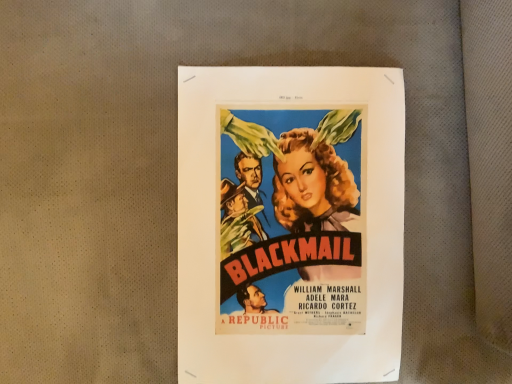
At what (x,y) coordinates should I click in order to perform the action: click on vibrant paper poster at center. Please return your answer as a coordinate pair (x, y). The width and height of the screenshot is (512, 384). Looking at the image, I should click on (290, 224).

This screenshot has width=512, height=384. Describe the element at coordinates (290, 224) in the screenshot. I see `vibrant paper poster at center` at that location.

Identify the location of vibrant paper poster at center. The height and width of the screenshot is (384, 512). (290, 224).